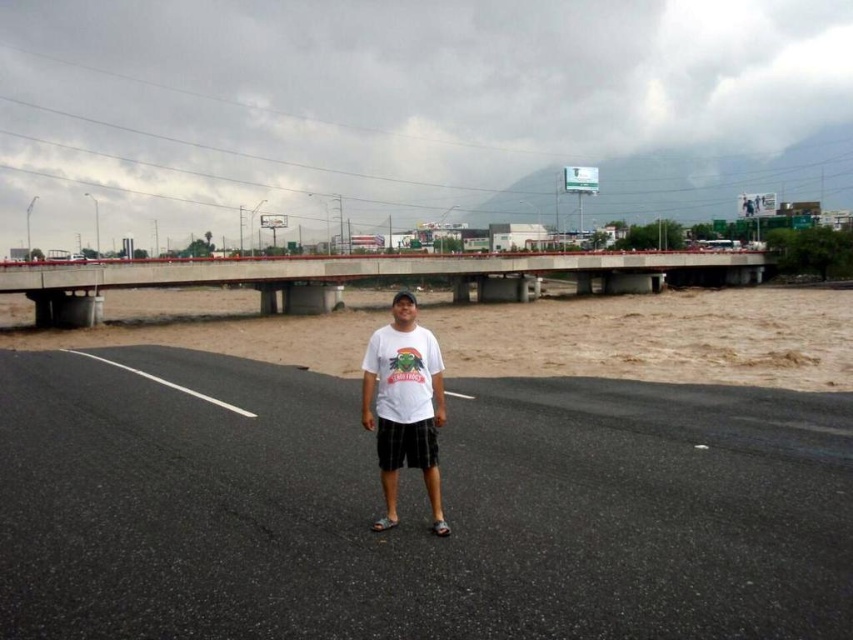
Is concrete bridge at upper center above white matte t-shirt at center?

Correct, concrete bridge at upper center is located above white matte t-shirt at center.

Looking at this image, who is shorter, concrete bridge at upper center or white matte t-shirt at center?

With less height is white matte t-shirt at center.

Who is more distant from viewer, (294,276) or (433,417)?

The point (294,276) is more distant.

Find the location of a particular element. concrete bridge at upper center is located at coordinates (374, 275).

Does black asphalt highway at center have a lesser height compared to concrete bridge at upper center?

Yes, black asphalt highway at center is shorter than concrete bridge at upper center.

Between black asphalt highway at center and concrete bridge at upper center, which one appears on the right side from the viewer's perspective?

concrete bridge at upper center is more to the right.

The width and height of the screenshot is (853, 640). What do you see at coordinates (413, 508) in the screenshot? I see `black asphalt highway at center` at bounding box center [413, 508].

Where is `black asphalt highway at center`? The width and height of the screenshot is (853, 640). black asphalt highway at center is located at coordinates point(413,508).

Between black asphalt highway at center and white matte t-shirt at center, which one appears on the left side from the viewer's perspective?

Positioned to the left is white matte t-shirt at center.

Which is behind, point (190, 460) or point (433, 499)?

The point (190, 460) is behind.

Image resolution: width=853 pixels, height=640 pixels. What are the coordinates of `black asphalt highway at center` in the screenshot? It's located at (413, 508).